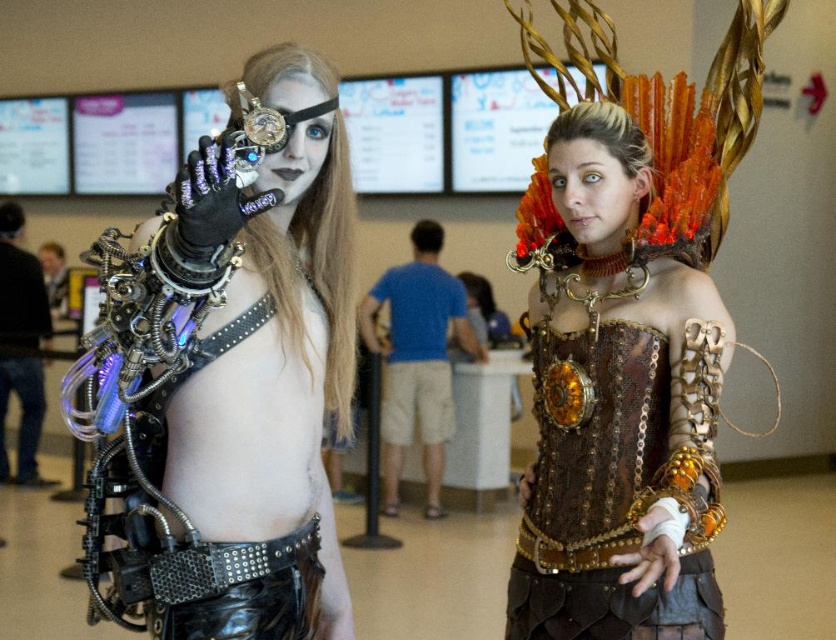
Question: In this image, where is brushed metal water gun at left located relative to matte black eye at center?

Choices:
 (A) right
 (B) left

Answer: (B)

Question: Can you confirm if brushed metal water gun at left is positioned to the right of matte black face at center?

Choices:
 (A) yes
 (B) no

Answer: (A)

Question: Among these points, which one is farthest from the camera?

Choices:
 (A) (424, 230)
 (B) (575, 166)

Answer: (A)

Question: Can you confirm if brown leather corset at center is positioned below brushed metal water gun at left?

Choices:
 (A) no
 (B) yes

Answer: (A)

Question: Which of the following is the farthest from the observer?

Choices:
 (A) matte black eye at center
 (B) brushed metal water gun at left
 (C) brown leather corset at center

Answer: (B)

Question: Which of the following is the closest to the observer?

Choices:
 (A) (609, 150)
 (B) (60, 268)
 (C) (464, 324)
 (D) (288, 104)

Answer: (D)